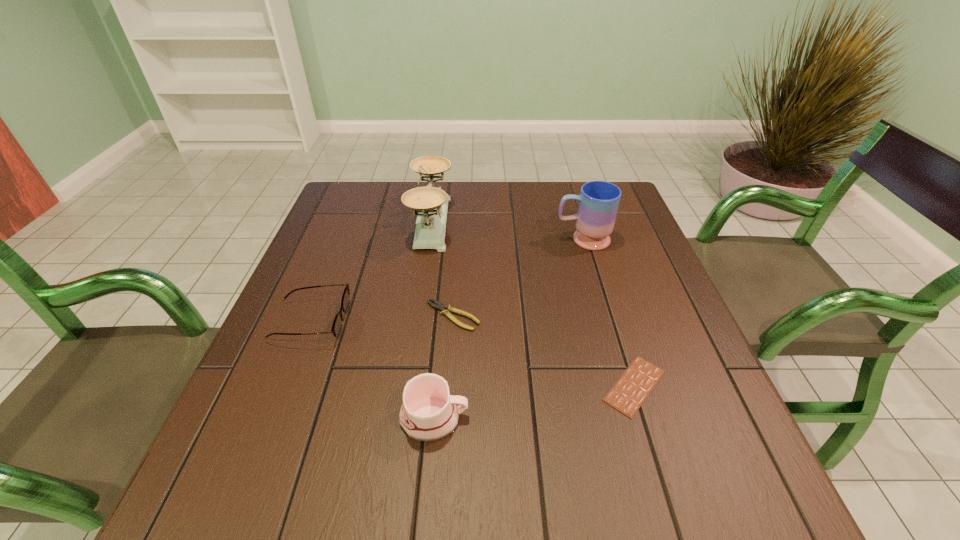
You are a GUI agent. You are given a task and a screenshot of the screen. Output one action in this format:
    pyautogui.click(x=<x>, y=<y>)
    Task: Click on the free area in between the right mug and the second shortest object
    
    Given the screenshot: What is the action you would take?
    pyautogui.click(x=517, y=278)

Find the location of a particular element. free space between the pliers and the second tallest object is located at coordinates (517, 278).

This screenshot has height=540, width=960. Find the location of `empty location between the chocolate bar and the right mug`. empty location between the chocolate bar and the right mug is located at coordinates (609, 313).

You are a GUI agent. You are given a task and a screenshot of the screen. Output one action in this format:
    pyautogui.click(x=<x>, y=<y>)
    Task: Click on the free point between the scale and the fourth shortest object
    The image size is (960, 540).
    Given the screenshot: What is the action you would take?
    pyautogui.click(x=433, y=320)

Identify the location of free space between the third shortest object and the chocolate bar. This screenshot has height=540, width=960. (472, 354).

Identify the location of free spot between the tallest object and the chocolate bar. (533, 304).

Where is `free spot between the second tallest object and the pliers`? free spot between the second tallest object and the pliers is located at coordinates (517, 278).

Locate an element on the screen. Image resolution: width=960 pixels, height=540 pixels. object identified as the second closest to the shorter mug is located at coordinates (337, 325).

Locate an element on the screen. the fifth closest object to the shortest object is located at coordinates (337, 325).

Locate an element on the screen. vacant region that satisfies the following two spatial constraints: 1. on the front-facing side of the shortest object; 2. on the right side of the tallest object is located at coordinates (407, 386).